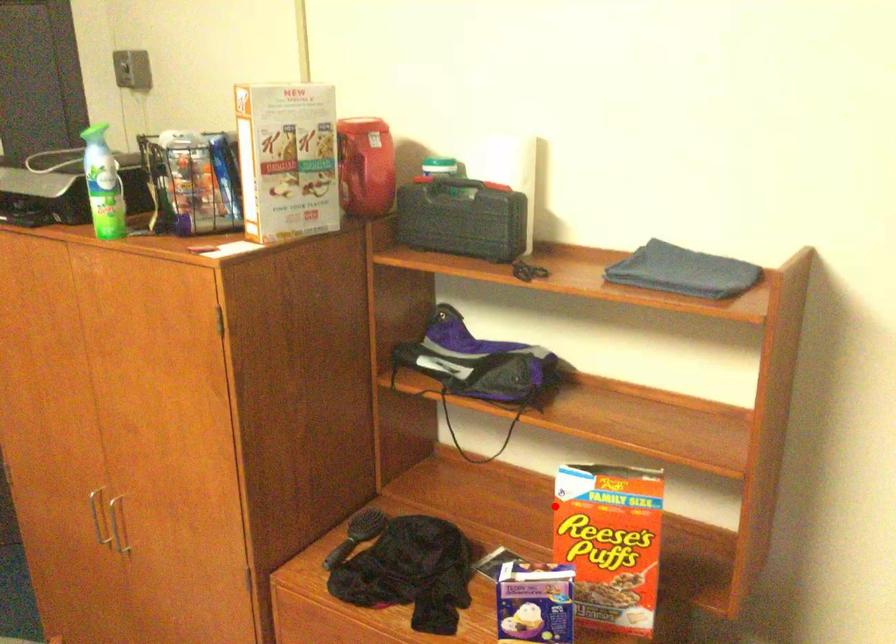
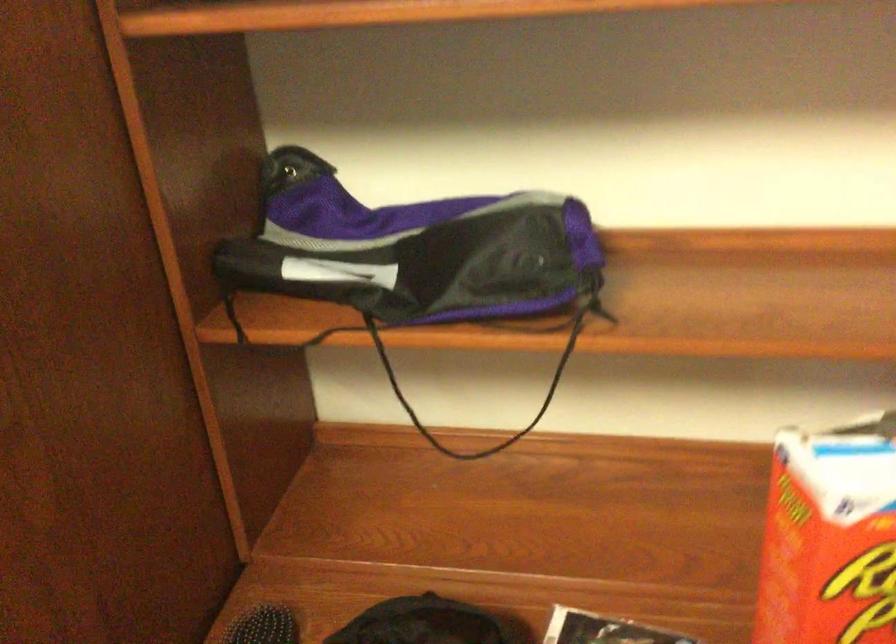
Find the pixel in the second image that matches the highlighted location in the first image.

(830, 538)